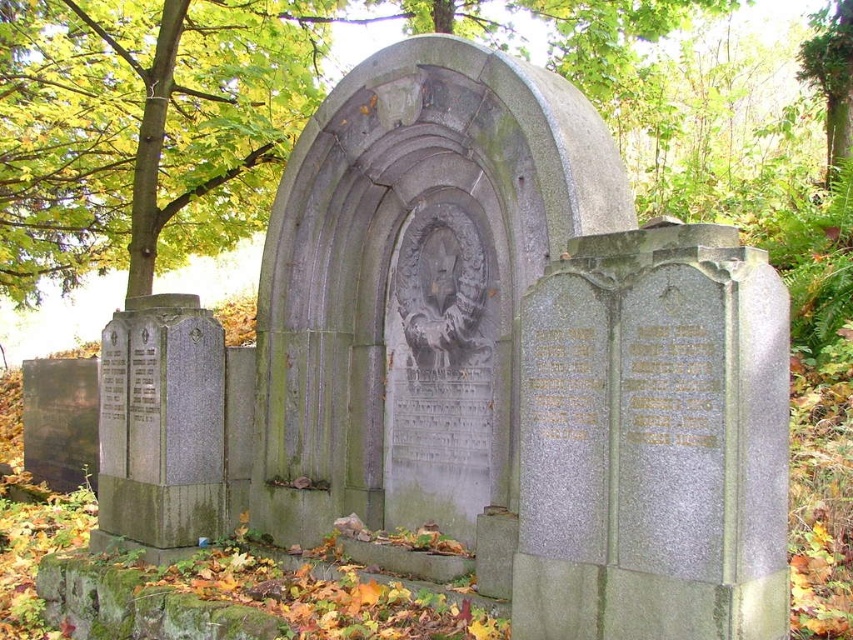
Does green leafy tree at upper center lie behind gray stone plaque at left?

Yes, it is.

Is point (120, 189) more distant than point (151, 368)?

That is True.

What do you see at coordinates (204, 113) in the screenshot? This screenshot has height=640, width=853. I see `green leafy tree at upper center` at bounding box center [204, 113].

Identify the location of green leafy tree at upper center. Image resolution: width=853 pixels, height=640 pixels. (204, 113).

Which is above, green leafy tree at upper left or gray stone plaque at left?

green leafy tree at upper left

Between point (36, 157) and point (149, 454), which one is positioned behind?

The point (36, 157) is more distant.

Where is `green leafy tree at upper left`? The image size is (853, 640). green leafy tree at upper left is located at coordinates (143, 128).

Is green leafy tree at upper center further to camera compared to green leafy tree at upper left?

No, it is not.

Which of these two, green leafy tree at upper center or green leafy tree at upper left, stands taller?

Standing taller between the two is green leafy tree at upper center.

Between point (517, 12) and point (241, 52), which one is positioned in front?

Point (517, 12) is in front.

The width and height of the screenshot is (853, 640). Identify the location of green leafy tree at upper center. (204, 113).